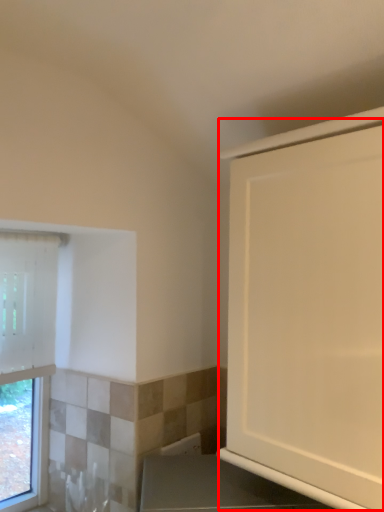
Question: From the image's perspective, where is screen door (annotated by the red box) located in relation to window in the image?

Choices:
 (A) above
 (B) below

Answer: (A)